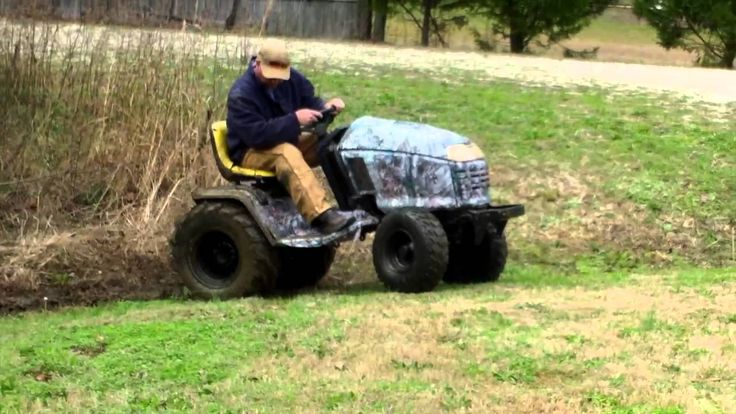
Locate an element on the screen. seat is located at coordinates (226, 164).